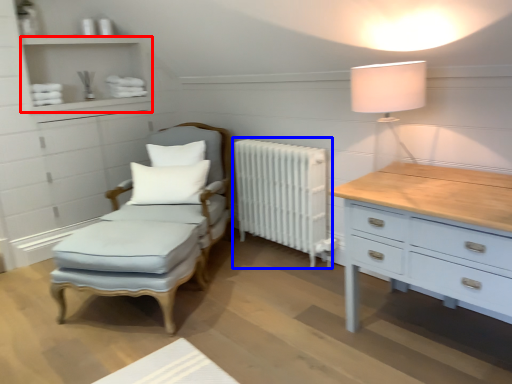
Question: Which of the following is the farthest to the observer, shelf (highlighted by a red box) or radiator (highlighted by a blue box)?

Choices:
 (A) shelf
 (B) radiator

Answer: (A)